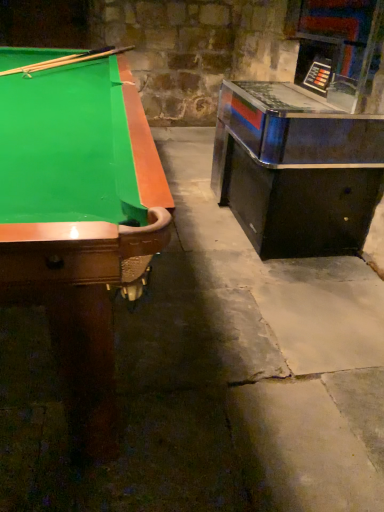
Where is `green felt pool table at left`? This screenshot has height=512, width=384. green felt pool table at left is located at coordinates (78, 214).

Locate an element on the screen. metallic/reflective game machine at right is located at coordinates (296, 170).

This screenshot has width=384, height=512. I want to click on green felt pool table at left, so click(78, 214).

Which is more to the left, metallic/reflective game machine at right or green felt pool table at left?

Positioned to the left is green felt pool table at left.

Is green felt pool table at left inside metallic/reflective game machine at right?

No.

From a real-world perspective, which is physically below, metallic/reflective game machine at right or green felt pool table at left?

From a 3D spatial view, green felt pool table at left is below.

Based on the photo, what's the angular difference between metallic/reflective game machine at right and green felt pool table at left's facing directions?

0.119 degrees.

Is point (104, 260) behind point (249, 119)?

No, it is not.

Is the surface of green felt pool table at left in direct contact with metallic/reflective game machine at right?

green felt pool table at left and metallic/reflective game machine at right are clearly separated.

Which is more to the left, green felt pool table at left or metallic/reflective game machine at right?

green felt pool table at left is more to the left.

Does point (335, 165) come farther from viewer compared to point (26, 70)?

No, (335, 165) is in front of (26, 70).

You are a GUI agent. You are given a task and a screenshot of the screen. Output one action in this format:
    pyautogui.click(x=<x>, y=<y>)
    Task: Click on the table lying in front of the wooden cue at upper left
    The width and height of the screenshot is (384, 512).
    Given the screenshot: What is the action you would take?
    pyautogui.click(x=296, y=170)

Would you say metallic/reflective game machine at right is to the left or to the right of wooden cue at upper left in the picture?

Based on their positions, metallic/reflective game machine at right is located to the right of wooden cue at upper left.

From the image's perspective, is metallic/reflective game machine at right over wooden cue at upper left?

Actually, metallic/reflective game machine at right appears below wooden cue at upper left in the image.

Is wooden cue at upper left oriented towards metallic/reflective game machine at right?

No, wooden cue at upper left is not facing towards metallic/reflective game machine at right.

Between point (46, 64) and point (287, 142), which one is positioned in front?

Positioned in front is point (287, 142).

This screenshot has height=512, width=384. I want to click on cue behind the metallic/reflective game machine at right, so click(x=66, y=61).

From the image's perspective, which one is positioned higher, wooden cue at upper left or metallic/reflective game machine at right?

wooden cue at upper left.

At what (x,y) coordinates should I click in order to perform the action: click on billiard table in front of the wooden cue at upper left. Please return your answer as a coordinate pair (x, y). The height and width of the screenshot is (512, 384). Looking at the image, I should click on pos(78,214).

Would you say green felt pool table at left is a long distance from wooden cue at upper left?

green felt pool table at left is near wooden cue at upper left, not far away.

Is green felt pool table at left oriented away from wooden cue at upper left?

No, green felt pool table at left's orientation is not away from wooden cue at upper left.

Can you confirm if green felt pool table at left is thinner than wooden cue at upper left?

Correct, the width of green felt pool table at left is less than that of wooden cue at upper left.

From the image's perspective, is wooden cue at upper left located beneath green felt pool table at left?

No, from the image's perspective, wooden cue at upper left is not beneath green felt pool table at left.

How many degrees apart are the facing directions of wooden cue at upper left and green felt pool table at left?

They differ by 62.5 degrees in their facing directions.

In terms of width, does wooden cue at upper left look wider or thinner when compared to green felt pool table at left?

wooden cue at upper left is wider than green felt pool table at left.

Is wooden cue at upper left inside the boundaries of green felt pool table at left, or outside?

wooden cue at upper left lies within the bounds of green felt pool table at left.

In order to click on table to the right of green felt pool table at left in this screenshot , I will do `click(296, 170)`.

Locate an element on the screen. The image size is (384, 512). billiard table beneath the metallic/reflective game machine at right (from a real-world perspective) is located at coordinates (78, 214).

When comparing their distances from green felt pool table at left, does wooden cue at upper left or metallic/reflective game machine at right seem further?

metallic/reflective game machine at right is positioned further to the anchor green felt pool table at left.

Based on their spatial positions, is wooden cue at upper left or green felt pool table at left further from metallic/reflective game machine at right?

The object further to metallic/reflective game machine at right is wooden cue at upper left.

Which object lies further to the anchor point wooden cue at upper left, green felt pool table at left or metallic/reflective game machine at right?

Based on the image, metallic/reflective game machine at right appears to be further to wooden cue at upper left.

Estimate the real-world distances between objects in this image. Which object is closer to metallic/reflective game machine at right, green felt pool table at left or wooden cue at upper left?

Among the two, green felt pool table at left is located nearer to metallic/reflective game machine at right.

Looking at the image, which one is located further to green felt pool table at left, metallic/reflective game machine at right or wooden cue at upper left?

metallic/reflective game machine at right lies further to green felt pool table at left than the other object.

When comparing their distances from wooden cue at upper left, does metallic/reflective game machine at right or green felt pool table at left seem further?

metallic/reflective game machine at right lies further to wooden cue at upper left than the other object.

The image size is (384, 512). I want to click on table between green felt pool table at left and wooden cue at upper left along the z-axis, so click(x=296, y=170).